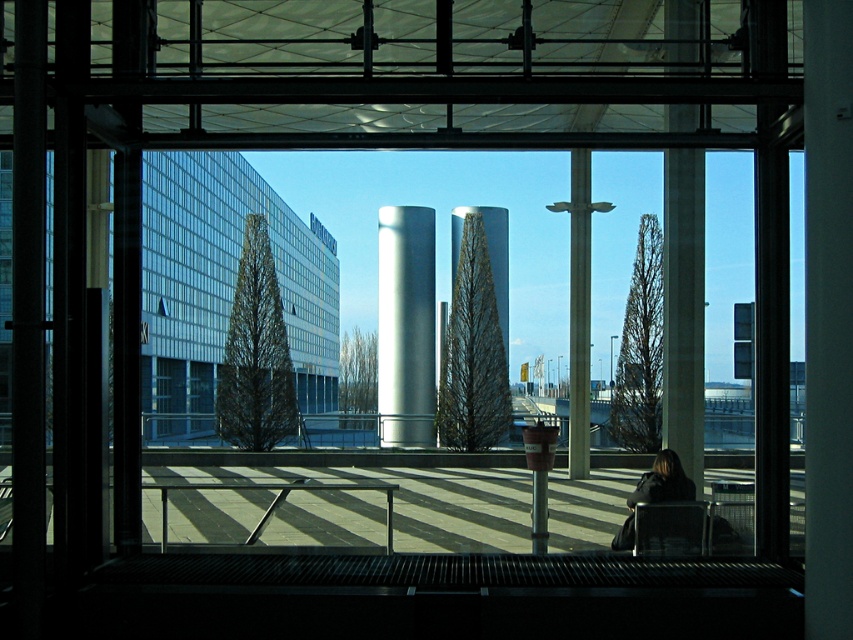
You are standing on the observation deck and want to determine which of the two points, point (428, 232) or point (653, 541), is closer to you. Based on the scene, can you tell which one is nearer?

Point (428, 232) is closer to you than point (653, 541) because it is further to the viewer according to the description.

You are standing on the observation deck and want to take a photo of the satin silver cylinder at center. If you face directly towards the cylinder, which direction should you turn to avoid including the leafy plants in your shot?

The satin silver cylinder at center is located at point coordinates, so to avoid the leafy plants, you should turn slightly to the left or right to frame the cylinder without the plants in the shot.

You are standing on the observation deck and want to take a photo of the satin silver cylinder at center. However, the dark brown leather jacket at lower right is blocking your view. Can you estimate if the jacket is taller than the cylinder?

The satin silver cylinder at center has a lesser height compared to dark brown leather jacket at lower right, so the jacket is taller and blocking the view.